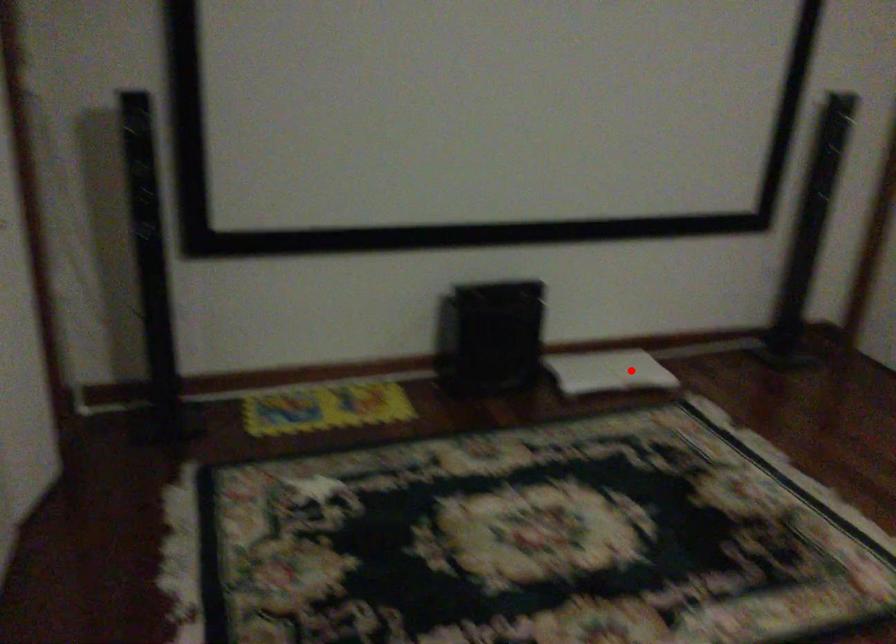
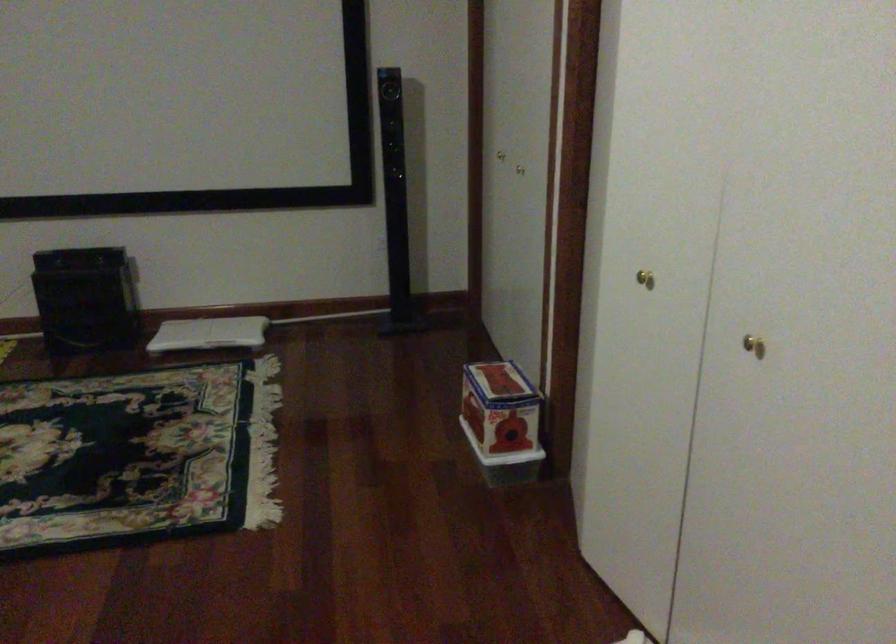
The point at the highlighted location is marked in the first image. Where is the corresponding point in the second image?

(209, 333)